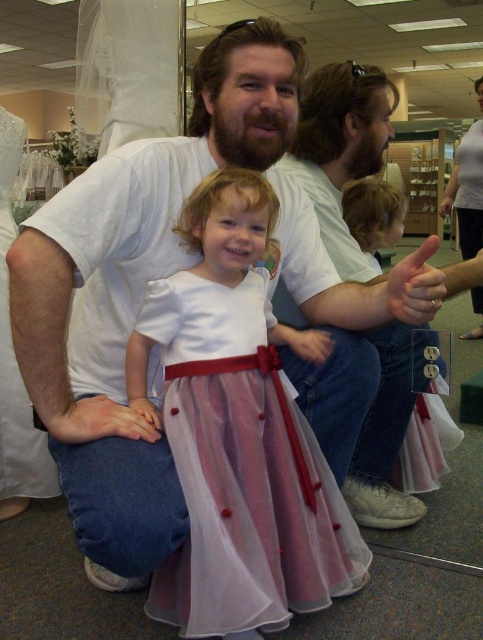
Question: Is matte white hand at center right smaller than matte white hand at center?

Choices:
 (A) yes
 (B) no

Answer: (B)

Question: Which point is farther to the camera?

Choices:
 (A) pink tulle dress at center
 (B) pink matte skin at lower left

Answer: (A)

Question: Which point is farther to the camera?

Choices:
 (A) matte white hand at center
 (B) pink matte skin at lower left

Answer: (A)

Question: Estimate the real-world distances between objects in this image. Which object is farther from the matte white hand at center right?

Choices:
 (A) pastel chiffon dress at center
 (B) pink tulle dress at center
 (C) pink matte skin at lower left
 (D) matte white hand at center

Answer: (C)

Question: Is pink matte skin at lower left above matte white hand at center?

Choices:
 (A) yes
 (B) no

Answer: (B)

Question: Is pink matte skin at lower left positioned before matte white hand at center?

Choices:
 (A) yes
 (B) no

Answer: (A)